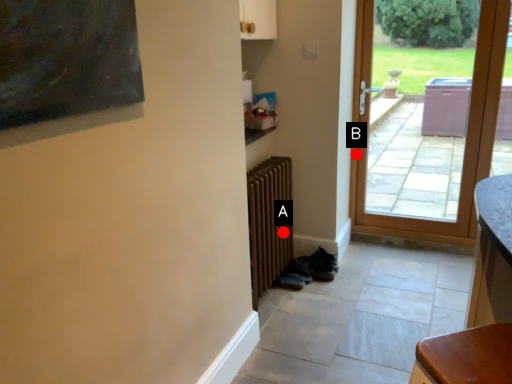
Question: Two points are circled on the image, labeled by A and B beside each circle. Which of the following is the farthest from the observer?

Choices:
 (A) A is further
 (B) B is further

Answer: (B)